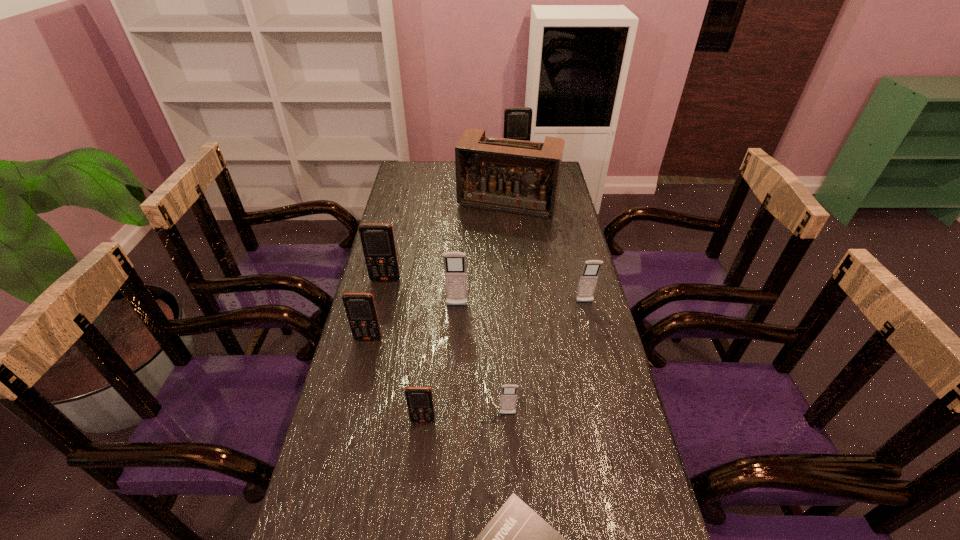
Identify the location of the third nearest cellular telephone. (360, 308).

The height and width of the screenshot is (540, 960). I want to click on the third object from left to right, so click(419, 400).

Locate an element on the screen. The width and height of the screenshot is (960, 540). the third orange cellular telephone from left to right is located at coordinates (419, 400).

You are a GUI agent. You are given a task and a screenshot of the screen. Output one action in this format:
    pyautogui.click(x=<x>, y=<y>)
    Task: Click on the smallest gray cellular telephone
    
    Given the screenshot: What is the action you would take?
    pyautogui.click(x=508, y=397)

Identify the location of the fifth cellular telephone from left to right. The height and width of the screenshot is (540, 960). (508, 397).

At what (x,y) coordinates should I click in order to perform the action: click on free spot located on the screen of the farthest object. Please return your answer as a coordinate pair (x, y). The height and width of the screenshot is (540, 960). Looking at the image, I should click on (519, 199).

You are a GUI agent. You are given a task and a screenshot of the screen. Output one action in this format:
    pyautogui.click(x=<x>, y=<y>)
    Task: Click on the free space located on the front of the second farthest object
    The image size is (960, 540).
    Given the screenshot: What is the action you would take?
    pyautogui.click(x=513, y=261)

Find the location of a particular element. This screenshot has width=960, height=540. free location located 0.340m on the front-facing side of the leftmost gray cellular telephone is located at coordinates (451, 406).

You are a GUI agent. You are given a task and a screenshot of the screen. Output one action in this format:
    pyautogui.click(x=<x>, y=<y>)
    Task: Click on the vacant space located on the screen of the second biggest orange cellular telephone
    The image size is (960, 540).
    Given the screenshot: What is the action you would take?
    pyautogui.click(x=375, y=323)

I want to click on vacant position located on the front-facing side of the second biggest gray cellular telephone, so click(x=591, y=329).